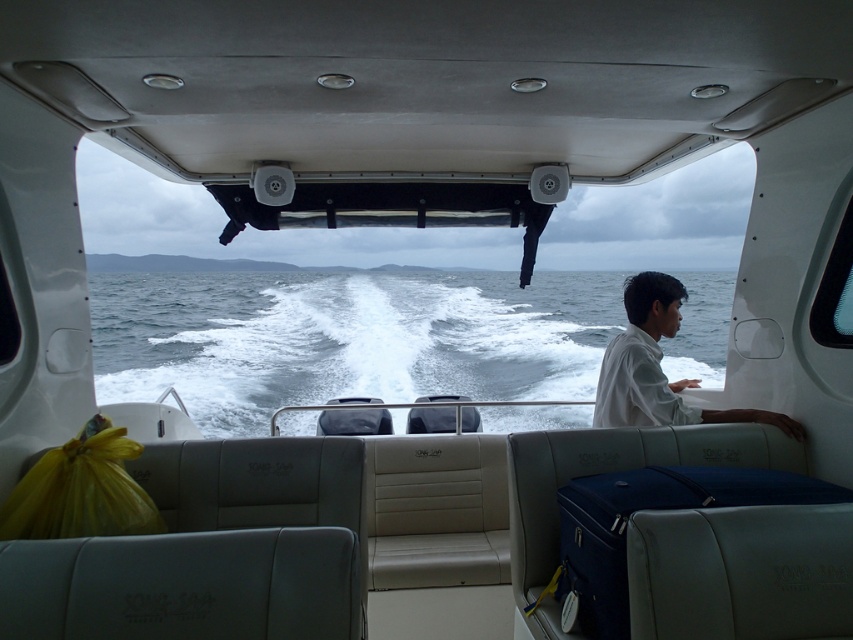
Question: Can you confirm if white foamy water at center is smaller than white matte shirt at right?

Choices:
 (A) yes
 (B) no

Answer: (B)

Question: Which of the following is the closest to the observer?

Choices:
 (A) white foamy water at center
 (B) white matte shirt at right

Answer: (B)

Question: Does white foamy water at center have a greater width compared to white matte shirt at right?

Choices:
 (A) no
 (B) yes

Answer: (B)

Question: Which point is farther to the camera?

Choices:
 (A) white foamy water at center
 (B) white matte shirt at right

Answer: (A)

Question: Is white foamy water at center positioned at the back of white matte shirt at right?

Choices:
 (A) yes
 (B) no

Answer: (A)

Question: Which point is farther to the camera?

Choices:
 (A) (483, 317)
 (B) (625, 298)

Answer: (A)